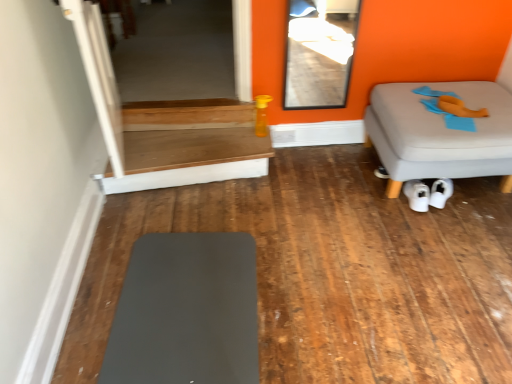
Where is `free spot in front of gray fabric ottoman at right, the 2th furniture when ordered from left to right`? The width and height of the screenshot is (512, 384). free spot in front of gray fabric ottoman at right, the 2th furniture when ordered from left to right is located at coordinates (440, 249).